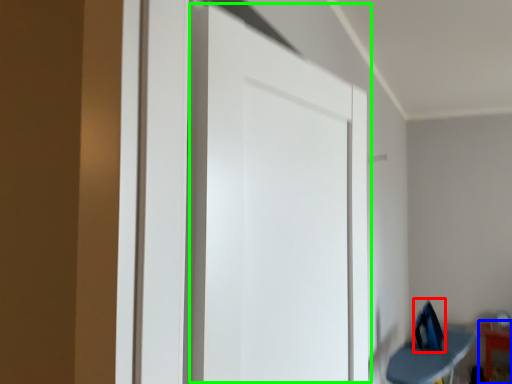
Question: Based on their relative distances, which object is farther from swivel chair (highlighted by a red box)? Choose from furniture (highlighted by a blue box) and door (highlighted by a green box).

Choices:
 (A) furniture
 (B) door

Answer: (B)